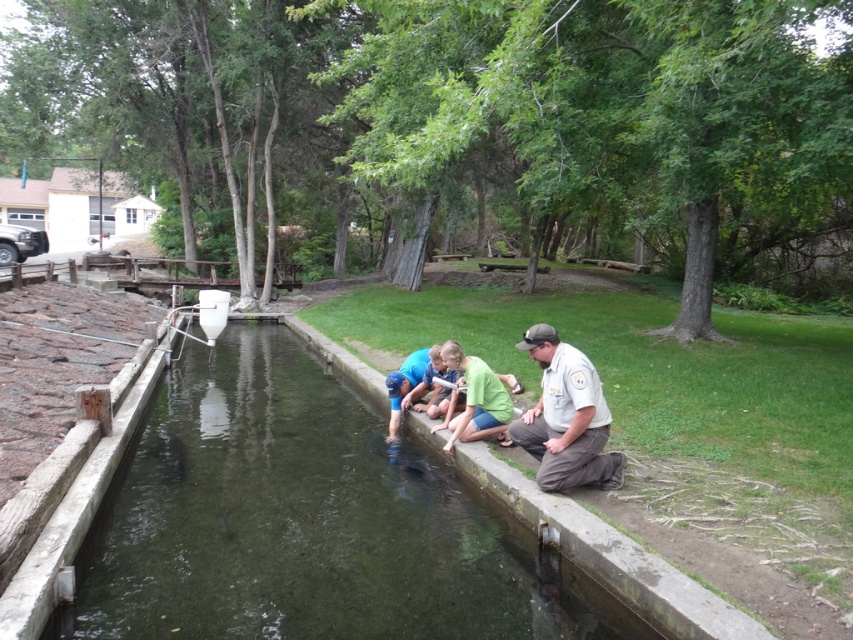
You are a park visitor who wants to take a photo of the clear concrete water at center. The park has a rule that you must stay at least 1 meter away from any water body. If your camera has a 2.5 meter focal length, can you take the photo from your current position without violating the rule?

The clear concrete water at center is located at coordinates point [306,522]. Since the park requires staying at least 1 meter away from the water, and your camera can focus up to 2.5 meters, you can take the photo as long as you remain at least 1 meter away but within the 2.5 meter range. However, without knowing the exact distance from your position to the water, it is impossible to confirm compliance with the rule. Please ensure you maintain the required distance.